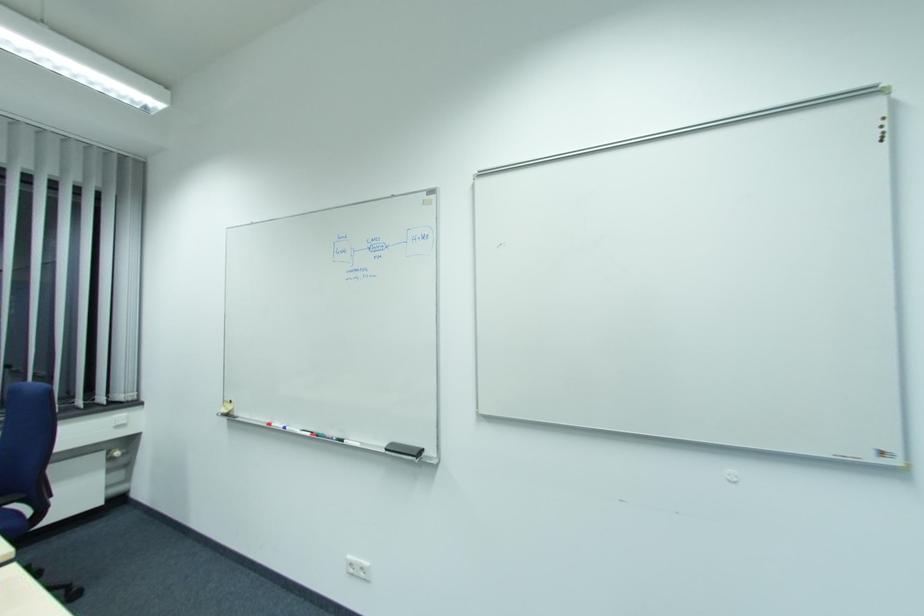
What do you see at coordinates (358, 567) in the screenshot?
I see `the white power outlet` at bounding box center [358, 567].